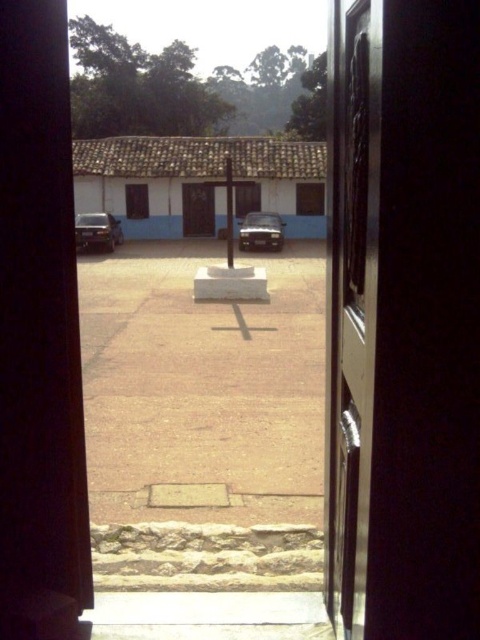
Image resolution: width=480 pixels, height=640 pixels. What do you see at coordinates (350, 301) in the screenshot?
I see `polished wood door at center` at bounding box center [350, 301].

Does polished wood door at center appear over satin silver car at center?

Incorrect, polished wood door at center is not positioned above satin silver car at center.

Is point (370, 292) positioned before point (264, 216)?

Yes, it is.

I want to click on polished wood door at center, so click(350, 301).

The width and height of the screenshot is (480, 640). What are the coordinates of `polished wood door at center` in the screenshot? It's located at (350, 301).

Which is behind, point (344, 593) or point (111, 221)?

Point (111, 221)

Identify the location of polished wood door at center. (350, 301).

Between point (92, 221) and point (269, 216), which one is positioned in front?

Positioned in front is point (92, 221).

Which is below, shiny black car at left or satin silver car at center?

shiny black car at left is below.

Is point (109, 224) farther from camera compared to point (262, 241)?

Yes, point (109, 224) is farther from viewer.

Find the location of a particular element. Image resolution: width=480 pixels, height=640 pixels. shiny black car at left is located at coordinates (96, 230).